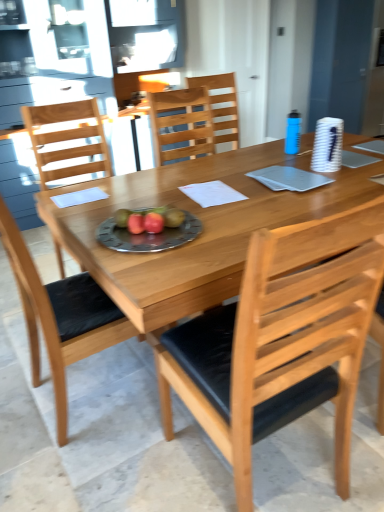
Find the location of a particular element. natural wood chair at center, which is the 4th chair from back to front is located at coordinates (281, 339).

The image size is (384, 512). What do you see at coordinates (61, 316) in the screenshot?
I see `light brown wood chair at left, which appears as the second chair when viewed from the front` at bounding box center [61, 316].

Describe the element at coordinates (148, 236) in the screenshot. The image size is (384, 512). I see `metallic silver plate with fruits at center` at that location.

What do you see at coordinates (136, 223) in the screenshot? The height and width of the screenshot is (512, 384). I see `red matte apple at center, placed as the second fruit when sorted from right to left` at bounding box center [136, 223].

Measure the distance between point (88, 155) and camera.

Point (88, 155) and camera are 2.47 meters apart from each other.

Where is `natural wood chair at center, arranged as the first chair when viewed from the front`? natural wood chair at center, arranged as the first chair when viewed from the front is located at coordinates (281, 339).

Between red matte apple at center, arranged as the first fruit when viewed from the left, and natural wood table at center, which one has larger width?

natural wood table at center.

Which of these two, red matte apple at center, arranged as the first fruit when viewed from the left, or natural wood table at center, is smaller?

With smaller size is red matte apple at center, arranged as the first fruit when viewed from the left.

What are the coordinates of `the 2nd fruit counting from the left of the natural wood table at center` in the screenshot? It's located at (136, 223).

Is red matte apple at center, placed as the second fruit when sorted from right to left, facing away from natural wood table at center?

No, red matte apple at center, placed as the second fruit when sorted from right to left, is not facing the opposite direction of natural wood table at center.

Which is farther, (222, 98) or (151, 251)?

The point (222, 98) is farther.

Find the location of `fruit dish below the wooden chair at center, which appears as the 1th chair when viewed from the back (from a real-world perspective)`. fruit dish below the wooden chair at center, which appears as the 1th chair when viewed from the back (from a real-world perspective) is located at coordinates (148, 236).

From the picture: Considering the sizes of objects wooden chair at center, arranged as the fourth chair when viewed from the front, and metallic silver plate with fruits at center in the image provided, who is wider, wooden chair at center, arranged as the fourth chair when viewed from the front, or metallic silver plate with fruits at center?

With larger width is wooden chair at center, arranged as the fourth chair when viewed from the front.

Who is smaller, natural wood chair at center, which is the 4th chair from back to front, or light brown wood chair at center, placed as the 3th chair when sorted from front to back?

light brown wood chair at center, placed as the 3th chair when sorted from front to back, is smaller.

Could you tell me if natural wood chair at center, which is the 4th chair from back to front, is turned towards light brown wood chair at center, which appears as the 2th chair when viewed from the back?

Yes.

Which object is positioned more to the right, natural wood chair at center, arranged as the first chair when viewed from the front, or light brown wood chair at center, which appears as the 2th chair when viewed from the back?

natural wood chair at center, arranged as the first chair when viewed from the front.

From the image's perspective, which object appears higher, light brown wood chair at left, acting as the third chair starting from the back, or wooden chair at center, which appears as the 1th chair when viewed from the back?

wooden chair at center, which appears as the 1th chair when viewed from the back, is shown above in the image.

Which of these two, light brown wood chair at left, which appears as the second chair when viewed from the front, or wooden chair at center, which appears as the 1th chair when viewed from the back, is wider?

light brown wood chair at left, which appears as the second chair when viewed from the front, is wider.

From a real-world perspective, between light brown wood chair at left, acting as the third chair starting from the back, and wooden chair at center, arranged as the fourth chair when viewed from the front, who is vertically higher?

From a 3D spatial view, wooden chair at center, arranged as the fourth chair when viewed from the front, is above.

Between light brown wood chair at left, which appears as the second chair when viewed from the front, and wooden chair at center, which appears as the 1th chair when viewed from the back, which one has more height?

With more height is light brown wood chair at left, which appears as the second chair when viewed from the front.

Considering the sizes of objects metallic silver plate with fruits at center and red matte apple at center, placed as the 1th fruit when sorted from right to left, in the image provided, who is thinner, metallic silver plate with fruits at center or red matte apple at center, placed as the 1th fruit when sorted from right to left,?

Thinner between the two is red matte apple at center, placed as the 1th fruit when sorted from right to left.

Is the depth of metallic silver plate with fruits at center less than that of red matte apple at center, placed as the 1th fruit when sorted from right to left?

That is True.

From a real-world perspective, is metallic silver plate with fruits at center physically above red matte apple at center, which is the 2th fruit in left-to-right order?

No, from a real-world perspective, metallic silver plate with fruits at center is not over red matte apple at center, which is the 2th fruit in left-to-right order

Where is `fruit on the right of metallic silver plate with fruits at center`? The height and width of the screenshot is (512, 384). fruit on the right of metallic silver plate with fruits at center is located at coordinates (153, 222).

Which object is closer to the camera, red matte apple at center, which is the 2th fruit in left-to-right order, or wooden chair at center, arranged as the fourth chair when viewed from the front?

red matte apple at center, which is the 2th fruit in left-to-right order, is in front.

From the image's perspective, is red matte apple at center, which is the 2th fruit in left-to-right order, under wooden chair at center, arranged as the fourth chair when viewed from the front?

Correct, red matte apple at center, which is the 2th fruit in left-to-right order, appears lower than wooden chair at center, arranged as the fourth chair when viewed from the front, in the image.

Based on the photo, between red matte apple at center, which is the 2th fruit in left-to-right order, and wooden chair at center, which appears as the 1th chair when viewed from the back, which one has larger width?

Wider between the two is wooden chair at center, which appears as the 1th chair when viewed from the back.

Who is shorter, red matte apple at center, placed as the 1th fruit when sorted from right to left, or wooden chair at center, which appears as the 1th chair when viewed from the back?

red matte apple at center, placed as the 1th fruit when sorted from right to left.

There is a natural wood chair at center, arranged as the first chair when viewed from the front. Where is `the 2nd fruit above it (from the image's perspective)`? This screenshot has width=384, height=512. the 2nd fruit above it (from the image's perspective) is located at coordinates (136, 223).

Is there a large distance between natural wood chair at center, which is the 4th chair from back to front, and red matte apple at center, placed as the second fruit when sorted from right to left?

Actually, natural wood chair at center, which is the 4th chair from back to front, and red matte apple at center, placed as the second fruit when sorted from right to left, are a little close together.

From the image's perspective, who appears lower, natural wood chair at center, arranged as the first chair when viewed from the front, or red matte apple at center, placed as the second fruit when sorted from right to left?

natural wood chair at center, arranged as the first chair when viewed from the front, is shown below in the image.

From a real-world perspective, is natural wood chair at center, arranged as the first chair when viewed from the front, physically above red matte apple at center, placed as the second fruit when sorted from right to left?

Actually, natural wood chair at center, arranged as the first chair when viewed from the front, is physically below red matte apple at center, placed as the second fruit when sorted from right to left, in the real world.

The image size is (384, 512). In the image, there is a red matte apple at center, arranged as the first fruit when viewed from the left. What are the coordinates of `kitchen & dining room table below it (from a real-world perspective)` in the screenshot? It's located at (203, 228).

Starting from the metallic silver plate with fruits at center, which chair is the 2nd one to the right? Please provide its 2D coordinates.

[(221, 105)]

Which object lies nearer to the anchor point light brown wood chair at left, which appears as the second chair when viewed from the front, natural wood table at center or wooden chair at center, arranged as the fourth chair when viewed from the front?

natural wood table at center is positioned closer to the anchor light brown wood chair at left, which appears as the second chair when viewed from the front.

Which object lies nearer to the anchor point red matte apple at center, which is the 2th fruit in left-to-right order, wooden chair at center, which appears as the 1th chair when viewed from the back, or metallic silver plate with fruits at center?

metallic silver plate with fruits at center is closer to red matte apple at center, which is the 2th fruit in left-to-right order.

When comparing their distances from red matte apple at center, placed as the 1th fruit when sorted from right to left, does light brown wood chair at left, which appears as the second chair when viewed from the front, or light brown wood chair at center, placed as the 3th chair when sorted from front to back, seem closer?

Among the two, light brown wood chair at left, which appears as the second chair when viewed from the front, is located nearer to red matte apple at center, placed as the 1th fruit when sorted from right to left.

Based on their spatial positions, is metallic silver plate with fruits at center or natural wood chair at center, which is the 4th chair from back to front, further from red matte apple at center, arranged as the first fruit when viewed from the left?

Among the two, natural wood chair at center, which is the 4th chair from back to front, is located further to red matte apple at center, arranged as the first fruit when viewed from the left.

From the image, which object appears to be nearer to wooden chair at center, arranged as the fourth chair when viewed from the front, light brown wood chair at center, which appears as the 2th chair when viewed from the back, or red matte apple at center, which is the 2th fruit in left-to-right order?

light brown wood chair at center, which appears as the 2th chair when viewed from the back, lies closer to wooden chair at center, arranged as the fourth chair when viewed from the front, than the other object.

Looking at the image, which one is located further to natural wood table at center, metallic silver plate with fruits at center or light brown wood chair at center, placed as the 3th chair when sorted from front to back?

light brown wood chair at center, placed as the 3th chair when sorted from front to back, is positioned further to the anchor natural wood table at center.

Considering their positions, is natural wood chair at center, arranged as the first chair when viewed from the front, positioned further to light brown wood chair at center, placed as the 3th chair when sorted from front to back, than red matte apple at center, placed as the 1th fruit when sorted from right to left?

Based on the image, natural wood chair at center, arranged as the first chair when viewed from the front, appears to be further to light brown wood chair at center, placed as the 3th chair when sorted from front to back.

Which object lies further to the anchor point natural wood table at center, wooden chair at center, arranged as the fourth chair when viewed from the front, or red matte apple at center, arranged as the first fruit when viewed from the left?

wooden chair at center, arranged as the fourth chair when viewed from the front, lies further to natural wood table at center than the other object.

Image resolution: width=384 pixels, height=512 pixels. In order to click on kitchen & dining room table between natural wood chair at center, which is the 4th chair from back to front, and wooden chair at center, arranged as the fourth chair when viewed from the front, from front to back in this screenshot , I will do `click(203, 228)`.

In order to click on fruit located between light brown wood chair at left, which appears as the second chair when viewed from the front, and red matte apple at center, placed as the second fruit when sorted from right to left, in the depth direction in this screenshot , I will do `click(153, 222)`.

The width and height of the screenshot is (384, 512). I want to click on fruit located between red matte apple at center, placed as the 1th fruit when sorted from right to left, and wooden chair at center, which appears as the 1th chair when viewed from the back, in the depth direction, so click(136, 223).

Find the location of `fruit located between light brown wood chair at center, placed as the 3th chair when sorted from front to back, and metallic silver plate with fruits at center in the left-right direction`. fruit located between light brown wood chair at center, placed as the 3th chair when sorted from front to back, and metallic silver plate with fruits at center in the left-right direction is located at coordinates (136, 223).